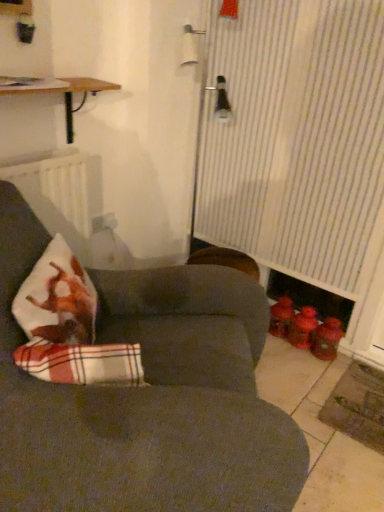
The image size is (384, 512). Describe the element at coordinates (57, 298) in the screenshot. I see `plush white pillow with red plaid at left` at that location.

Identify the location of wooden shelf at upper left. (63, 92).

At what (x,y) coordinates should I click in order to perform the action: click on white striped curtain at right. Please return your answer as a coordinate pair (x, y). The width and height of the screenshot is (384, 512). Looking at the image, I should click on (296, 136).

Where is `plush white pillow with red plaid at left`? This screenshot has width=384, height=512. plush white pillow with red plaid at left is located at coordinates (57, 298).

Measure the distance from plaid fabric cushion at lower left to dark gray fabric couch at center.

plaid fabric cushion at lower left is 9.94 inches from dark gray fabric couch at center.

Which of these two, plaid fabric cushion at lower left or dark gray fabric couch at center, stands shorter?

With less height is plaid fabric cushion at lower left.

Is plaid fabric cushion at lower left not close to dark gray fabric couch at center?

That's not correct — plaid fabric cushion at lower left is a little close to dark gray fabric couch at center.

From the image's perspective, which object appears higher, plaid fabric cushion at lower left or dark gray fabric couch at center?

plaid fabric cushion at lower left appears higher in the image.

Is dark gray fabric couch at center at the left side of plush white pillow with red plaid at left?

No.

Can we say dark gray fabric couch at center lies outside plush white pillow with red plaid at left?

dark gray fabric couch at center lies outside plush white pillow with red plaid at left's area.

Between dark gray fabric couch at center and plush white pillow with red plaid at left, which one has smaller width?

plush white pillow with red plaid at left is thinner.

Is point (138, 460) farther from camera compared to point (36, 315)?

That is False.

From the image's perspective, is plush white pillow with red plaid at left over white striped curtain at right?

Actually, plush white pillow with red plaid at left appears below white striped curtain at right in the image.

Is plush white pillow with red plaid at left wider than white striped curtain at right?

Yes, plush white pillow with red plaid at left is wider than white striped curtain at right.

Is white striped curtain at right inside plush white pillow with red plaid at left?

Actually, white striped curtain at right is outside plush white pillow with red plaid at left.

In the scene shown: Considering the positions of objects plush white pillow with red plaid at left and white striped curtain at right in the image provided, who is behind, plush white pillow with red plaid at left or white striped curtain at right?

Positioned behind is white striped curtain at right.

Identify the location of table above the white matte radiator at left (from the image's perspective). (63, 92).

Which of these two, white matte radiator at left or wooden shelf at upper left, is thinner?

white matte radiator at left.

Is white matte radiator at left positioned far away from wooden shelf at upper left?

Actually, white matte radiator at left and wooden shelf at upper left are a little close together.

From a real-world perspective, does white striped curtain at right sit lower than dark gray fabric couch at center?

No.

Find the location of a particular element. Image resolution: width=384 pixels, height=512 pixels. curtain on the right of the dark gray fabric couch at center is located at coordinates (296, 136).

Which is behind, point (285, 206) or point (11, 210)?

Point (285, 206)

Is wooden shelf at upper left at the left side of white matte radiator at left?

Incorrect, wooden shelf at upper left is not on the left side of white matte radiator at left.

Is wooden shelf at upper left bigger than white matte radiator at left?

Yes, wooden shelf at upper left is bigger than white matte radiator at left.

From a real-world perspective, is wooden shelf at upper left positioned over white matte radiator at left based on gravity?

Indeed, from a real-world perspective, wooden shelf at upper left stands above white matte radiator at left.

Considering the relative sizes of wooden shelf at upper left and white matte radiator at left in the image provided, is wooden shelf at upper left shorter than white matte radiator at left?

Indeed, wooden shelf at upper left has a lesser height compared to white matte radiator at left.

The image size is (384, 512). I want to click on linen below the wooden shelf at upper left (from a real-world perspective), so click(x=82, y=362).

Is wooden shelf at upper left further to the viewer compared to plaid fabric cushion at lower left?

Yes, wooden shelf at upper left is further from the camera.

Which of these two, wooden shelf at upper left or plaid fabric cushion at lower left, stands shorter?

plaid fabric cushion at lower left.

Is wooden shelf at upper left inside or outside of plaid fabric cushion at lower left?

wooden shelf at upper left lies outside plaid fabric cushion at lower left.

I want to click on studio couch below the plaid fabric cushion at lower left (from the image's perspective), so click(x=146, y=397).

Where is `throw pillow above the dark gray fabric couch at center (from the image's perspective)`? throw pillow above the dark gray fabric couch at center (from the image's perspective) is located at coordinates (57, 298).

Estimate the real-world distances between objects in this image. Which object is further from white striped curtain at right, dark gray fabric couch at center or plush white pillow with red plaid at left?

plush white pillow with red plaid at left.

Looking at the image, which one is located closer to white matte radiator at left, plush white pillow with red plaid at left or white striped curtain at right?

The object closer to white matte radiator at left is plush white pillow with red plaid at left.

From the image, which object appears to be nearer to white striped curtain at right, dark gray fabric couch at center or white matte radiator at left?

Based on the image, white matte radiator at left appears to be nearer to white striped curtain at right.

Considering their positions, is white striped curtain at right positioned further to wooden shelf at upper left than dark gray fabric couch at center?

The object further to wooden shelf at upper left is dark gray fabric couch at center.

Which object lies further to the anchor point white matte radiator at left, wooden shelf at upper left or dark gray fabric couch at center?

dark gray fabric couch at center is positioned further to the anchor white matte radiator at left.

From the image, which object appears to be nearer to white striped curtain at right, plush white pillow with red plaid at left or white matte radiator at left?

Among the two, white matte radiator at left is located nearer to white striped curtain at right.

In the scene shown: Based on their spatial positions, is dark gray fabric couch at center or white striped curtain at right further from white matte radiator at left?

white striped curtain at right lies further to white matte radiator at left than the other object.

Estimate the real-world distances between objects in this image. Which object is further from plaid fabric cushion at lower left, white matte radiator at left or white striped curtain at right?

white striped curtain at right lies further to plaid fabric cushion at lower left than the other object.

This screenshot has width=384, height=512. Identify the location of linen located between dark gray fabric couch at center and white matte radiator at left in the depth direction. (82, 362).

You are a GUI agent. You are given a task and a screenshot of the screen. Output one action in this format:
    pyautogui.click(x=<x>, y=<y>)
    Task: Click on the studio couch located between plush white pillow with red plaid at left and white striped curtain at right in the left-right direction
    This screenshot has width=384, height=512.
    Given the screenshot: What is the action you would take?
    pyautogui.click(x=146, y=397)

What are the coordinates of `linen between plush white pillow with red plaid at left and white striped curtain at right from left to right` in the screenshot? It's located at (82, 362).

You are a GUI agent. You are given a task and a screenshot of the screen. Output one action in this format:
    pyautogui.click(x=<x>, y=<y>)
    Task: Click on the linen between white matte radiator at left and white striped curtain at right from left to right
    Image resolution: width=384 pixels, height=512 pixels.
    Given the screenshot: What is the action you would take?
    pyautogui.click(x=82, y=362)